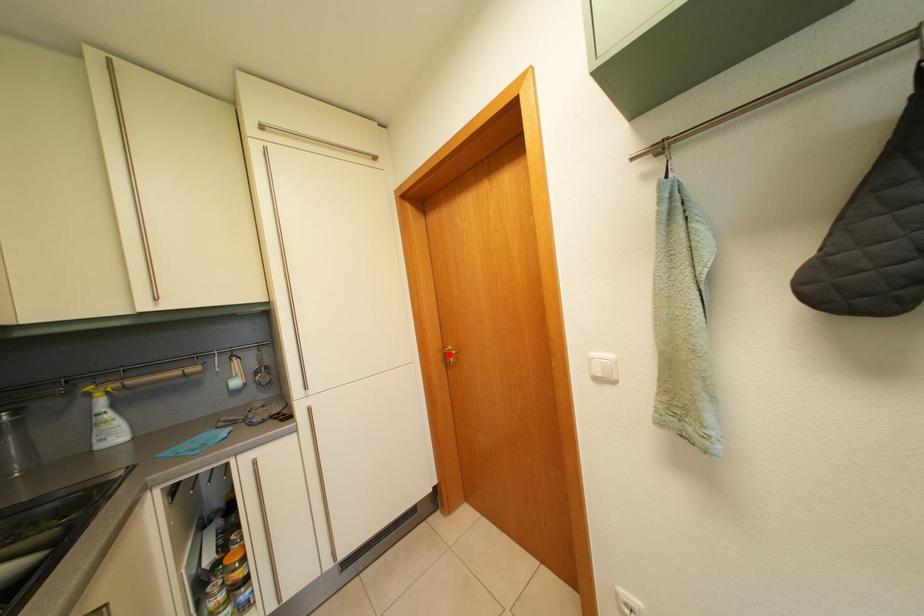
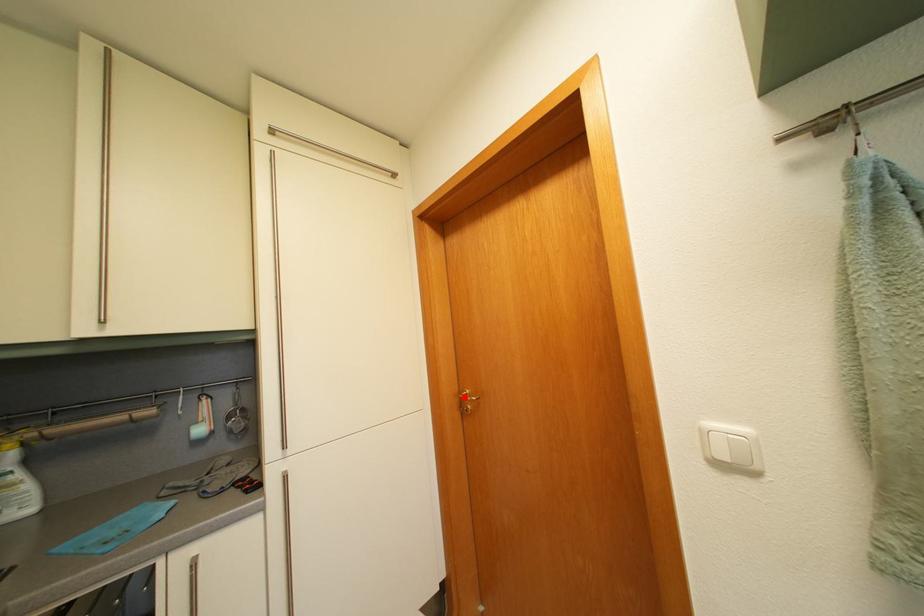
I am providing you with two images of the same scene from different viewpoints. A red point is marked on the first image and another point is marked on the second image. Do the highlighted points in image1 and image2 indicate the same real-world spot?

Yes